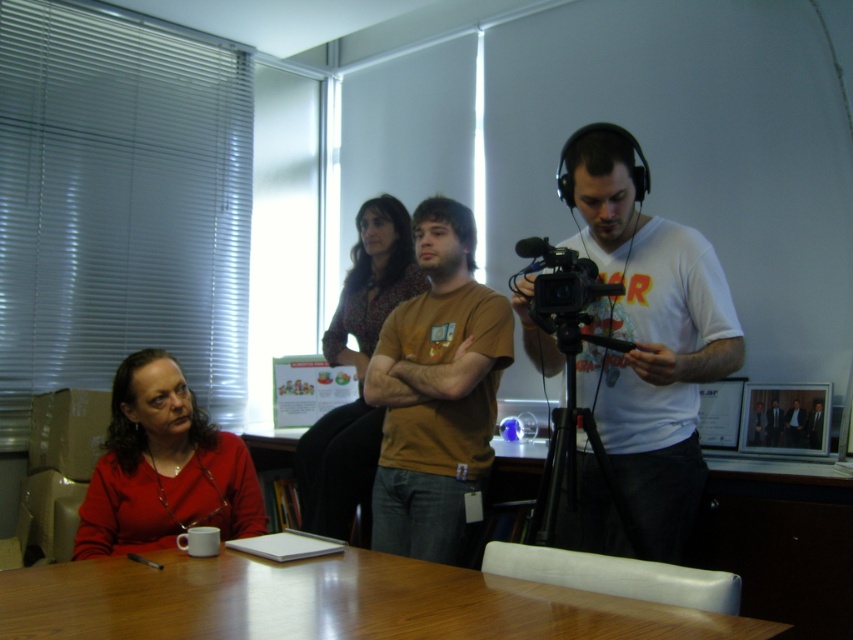
Question: Does wooden table at lower center have a greater width compared to black plastic video camera at center?

Choices:
 (A) no
 (B) yes

Answer: (B)

Question: Can you confirm if wooden table at lower center is wider than matte red shirt at lower left?

Choices:
 (A) no
 (B) yes

Answer: (B)

Question: Based on their relative distances, which object is nearer to the black metal tripod at center?

Choices:
 (A) matte red shirt at lower left
 (B) white matte camera at center
 (C) black plastic video camera at center
 (D) matte brown blouse at center

Answer: (B)

Question: Which object is closer to the camera taking this photo?

Choices:
 (A) brown cotton t-shirt at center
 (B) black metal tripod at center

Answer: (B)

Question: Can you confirm if wooden table at lower center is positioned to the right of black plastic video camera at center?

Choices:
 (A) yes
 (B) no

Answer: (B)

Question: Which point is farther to the camera?

Choices:
 (A) (59, 616)
 (B) (143, 355)
 (C) (357, 470)

Answer: (C)